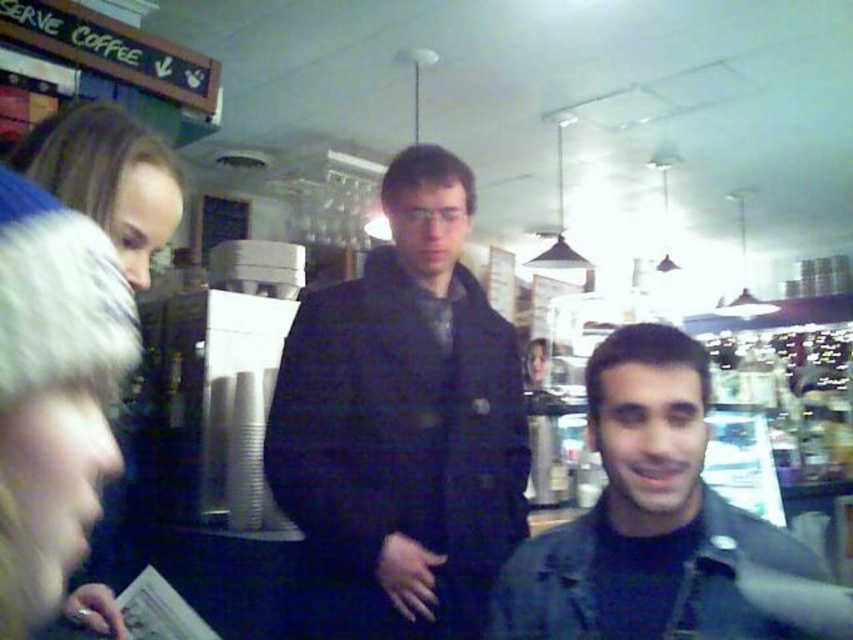
Does dark blue jacket at center have a greater height compared to blonde hair at left?

Yes, dark blue jacket at center is taller than blonde hair at left.

Locate an element on the screen. This screenshot has width=853, height=640. dark blue jacket at center is located at coordinates (402, 426).

Identify the location of dark blue jacket at center. (402, 426).

Looking at this image, does matte black jacket at lower right have a lesser width compared to blonde hair at left?

Incorrect, matte black jacket at lower right's width is not less than blonde hair at left's.

Can you confirm if matte black jacket at lower right is bigger than blonde hair at left?

Correct, matte black jacket at lower right is larger in size than blonde hair at left.

Is point (553, 609) closer to camera compared to point (88, 122)?

No, (553, 609) is behind (88, 122).

Where is `matte black jacket at lower right`? matte black jacket at lower right is located at coordinates (660, 525).

Is matte black jacket at lower right thinner than green painted wood signboard at upper left?

Answer: Correct, matte black jacket at lower right's width is less than green painted wood signboard at upper left's.

Which is more to the right, matte black jacket at lower right or green painted wood signboard at upper left?

matte black jacket at lower right

Between point (793, 589) and point (155, 80), which one is positioned behind?

Positioned behind is point (155, 80).

I want to click on matte black jacket at lower right, so click(660, 525).